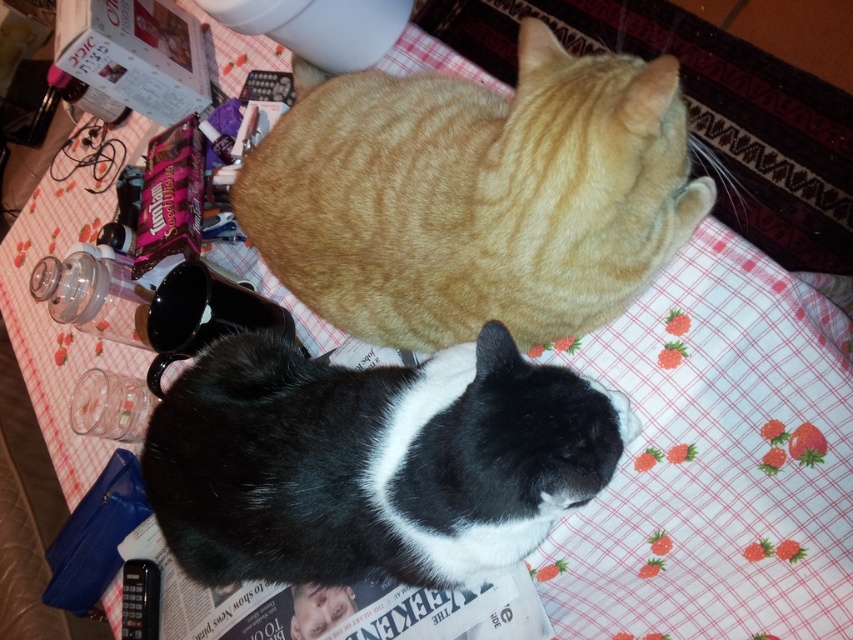
From the picture: You are a photographer trying to capture a clear photo of the black and white fur cat at center and the orange tabby cat at upper center. Which cat is blocking the view of the other?

The orange tabby cat at upper center is blocking the view of the black and white fur cat at center because the black and white fur cat at center is behind it.